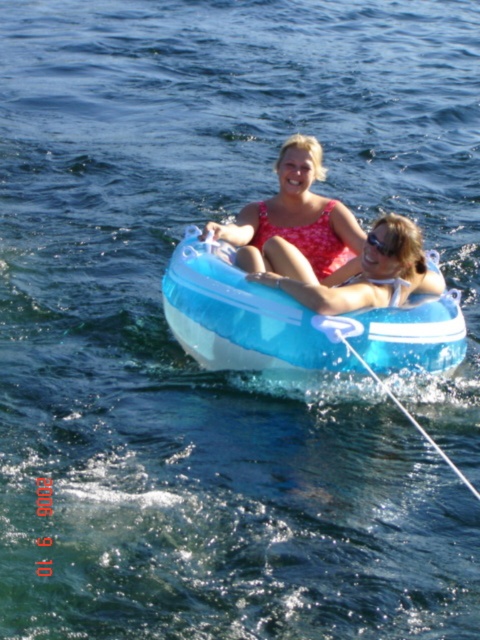
You are a photographer trying to capture the perfect shot of the floral swimsuit at center and the matte blue tube at center. To ensure both are in frame, should you adjust your camera to focus more to the left or the right?

The floral swimsuit at center is to the left of the matte blue tube at center, so you should focus more to the left to include both in the frame.

You are a photographer trying to capture the translucent blue tube at center in your shot. The camera you are using has a focal point at coordinates 0.5, 0.6. Is the tube within the camera focus area? Please explain your answer.

The translucent blue tube at center is located at coordinates (x=297, y=323), which is very close to the camera focal point at (x=288, y=320). Since the coordinates are nearly identical, the tube should be within the camera focus area.

You are a photographer trying to capture the floral swimsuit at center and the matte blue tube at center in a single shot. Since the tube is behind the swimsuit, will the tube be visible in the photo?

The matte blue tube at center is behind the floral swimsuit at center, so it might be partially or fully obscured depending on the angle and focus. However, since both are at the center, adjusting the camera angle slightly could allow the tube to be visible around or behind the swimsuit.